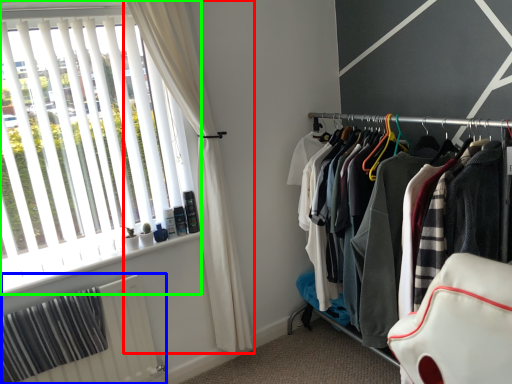
Question: Which is nearer to the curtain (highlighted by a red box)? radiator (highlighted by a blue box) or window (highlighted by a green box).

Choices:
 (A) radiator
 (B) window

Answer: (B)